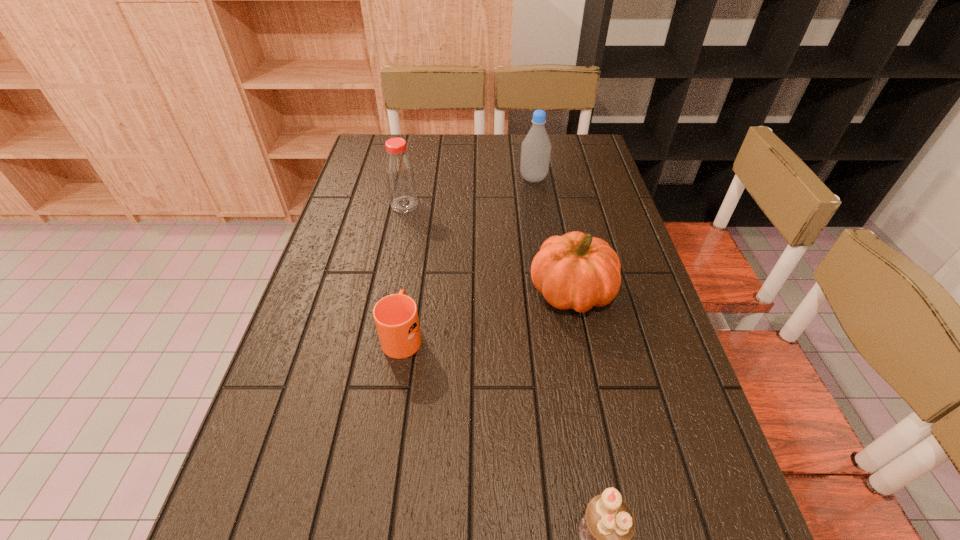
Find the location of a particular element. The width and height of the screenshot is (960, 540). empty space that is in between the shortest object and the farthest object is located at coordinates (468, 256).

Identify which object is the third nearest to the pumpkin. Please provide its 2D coordinates. Your answer should be formatted as a tuple, i.e. [(x, y)], where the tuple contains the x and y coordinates of a point satisfying the conditions above.

[(400, 177)]

The image size is (960, 540). What are the coordinates of `object that stands as the closest to the second farthest object` in the screenshot? It's located at (536, 147).

Find the location of `free region that satisfies the following two spatial constraints: 1. on the back side of the left bottle; 2. on the right side of the farther bottle`. free region that satisfies the following two spatial constraints: 1. on the back side of the left bottle; 2. on the right side of the farther bottle is located at coordinates (410, 179).

Identify the location of free space that satisfies the following two spatial constraints: 1. on the front side of the farthest object; 2. on the left side of the pumpkin. (551, 293).

Find the location of a particular element. vacant point that satisfies the following two spatial constraints: 1. on the front side of the pumpkin; 2. on the left side of the farthest object is located at coordinates (551, 293).

Identify the location of free space that satisfies the following two spatial constraints: 1. on the front side of the right bottle; 2. on the left side of the pumpkin. This screenshot has height=540, width=960. (551, 293).

Identify the location of blank space that satisfies the following two spatial constraints: 1. on the back side of the right bottle; 2. on the right side of the fourth nearest object. The height and width of the screenshot is (540, 960). (410, 179).